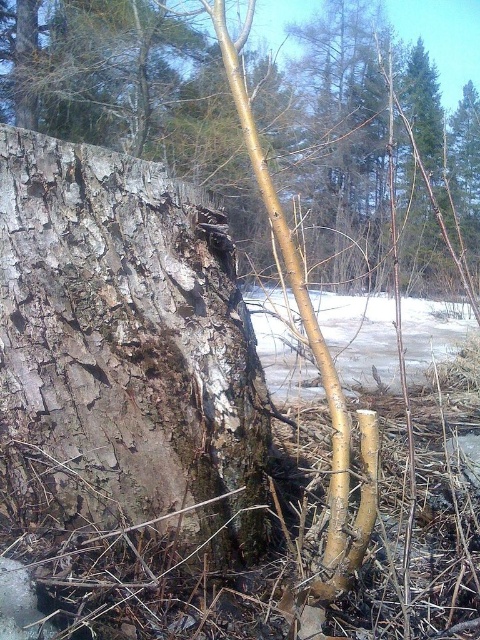
This screenshot has height=640, width=480. What do you see at coordinates (124, 353) in the screenshot? I see `grayish-brown bark at center` at bounding box center [124, 353].

Can you confirm if grayish-brown bark at center is positioned to the right of smooth bark tree trunk at center?

Correct, you'll find grayish-brown bark at center to the right of smooth bark tree trunk at center.

At what (x,y) coordinates should I click in order to perform the action: click on grayish-brown bark at center. Please return your answer as a coordinate pair (x, y). This screenshot has height=640, width=480. Looking at the image, I should click on (124, 353).

Where is `grayish-brown bark at center`? This screenshot has width=480, height=640. grayish-brown bark at center is located at coordinates (124, 353).